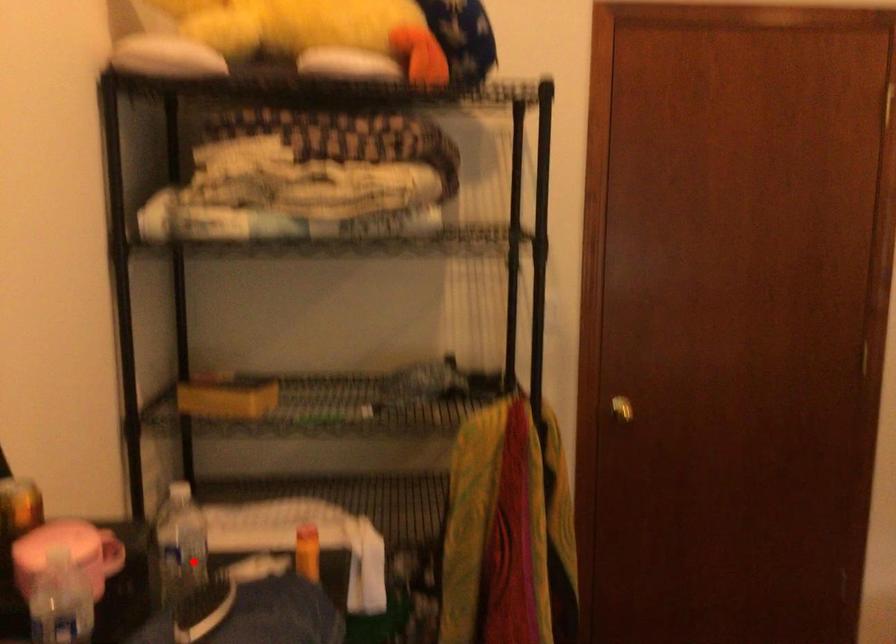
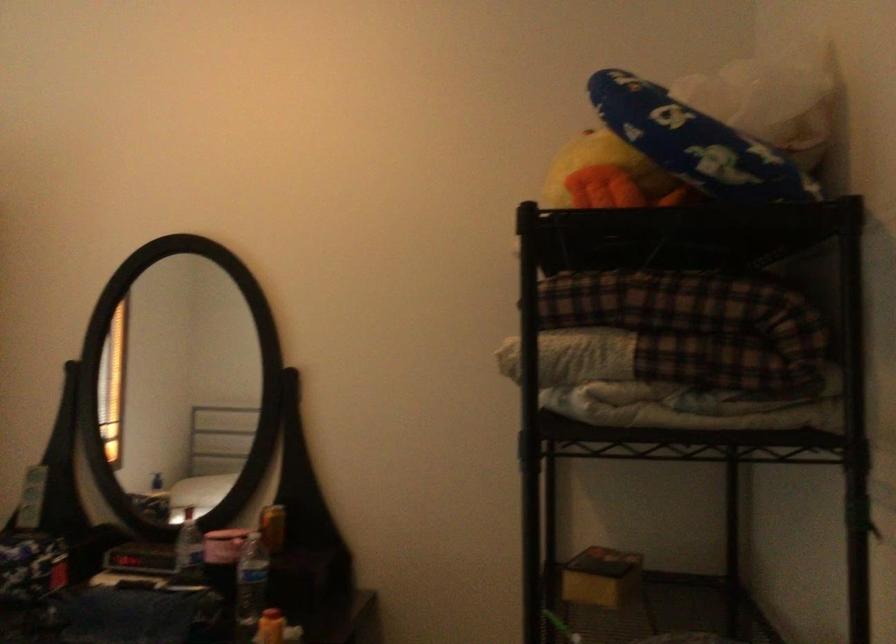
Find the pixel in the second image that matches the highlighted location in the first image.

(250, 585)